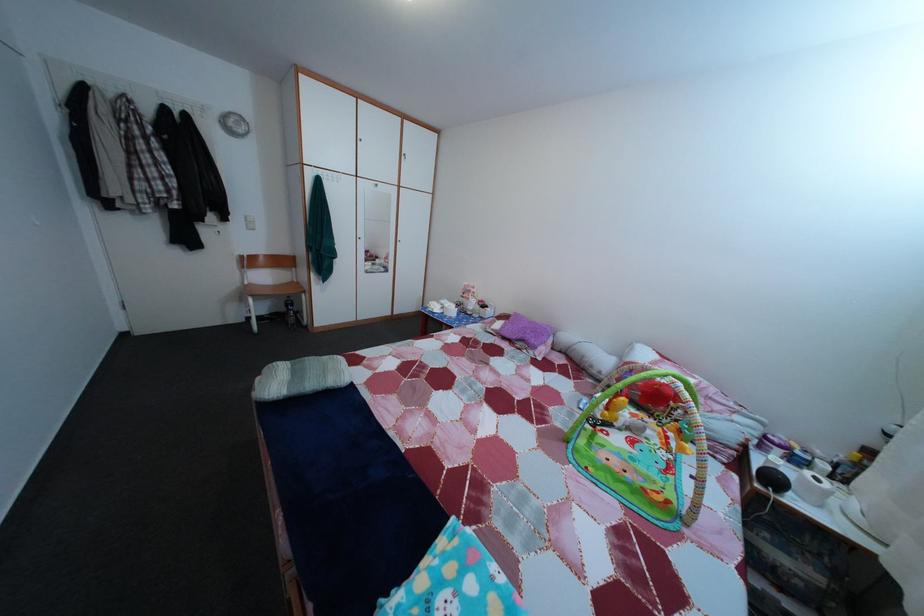
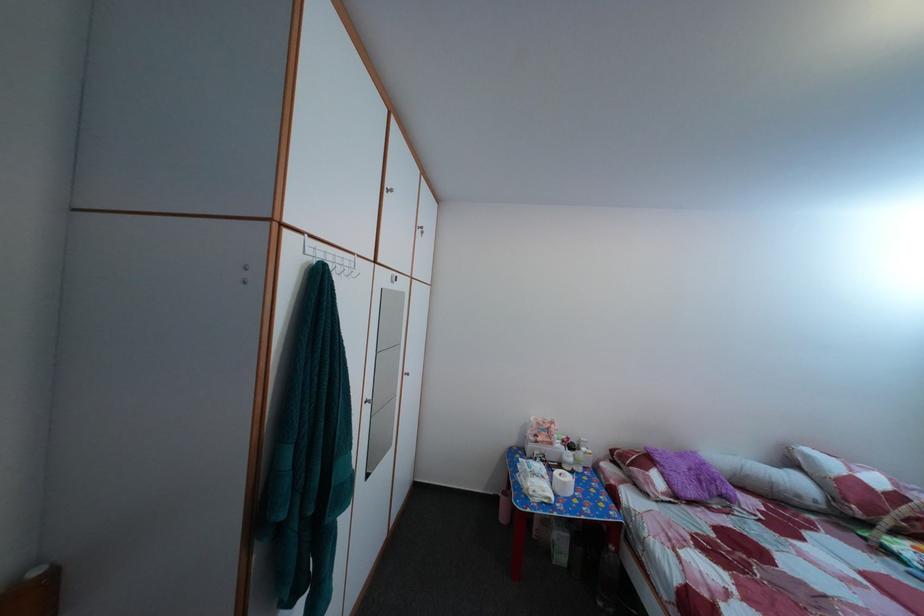
In the second image, find the point that corresponds to (492,309) in the first image.

(578, 447)